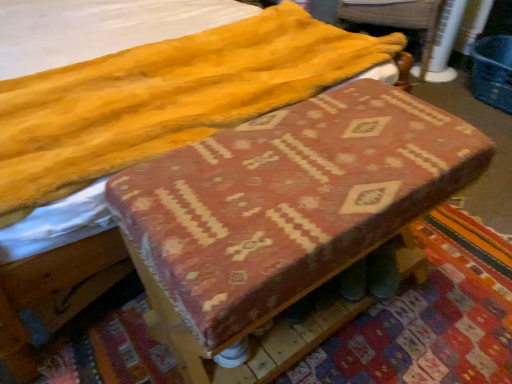
Question: From a real-world perspective, is textured fabric changing table at center positioned above or below wooden swivel chair at upper right?

Choices:
 (A) below
 (B) above

Answer: (B)

Question: Is textured fabric changing table at center bigger or smaller than wooden swivel chair at upper right?

Choices:
 (A) big
 (B) small

Answer: (A)

Question: Is textured fabric changing table at center inside the boundaries of wooden swivel chair at upper right, or outside?

Choices:
 (A) outside
 (B) inside

Answer: (A)

Question: Considering the positions of wooden swivel chair at upper right and textured fabric changing table at center in the image, is wooden swivel chair at upper right wider or thinner than textured fabric changing table at center?

Choices:
 (A) thin
 (B) wide

Answer: (B)

Question: From their relative heights in the image, would you say wooden swivel chair at upper right is taller or shorter than textured fabric changing table at center?

Choices:
 (A) tall
 (B) short

Answer: (B)

Question: From a real-world perspective, is wooden swivel chair at upper right positioned above or below textured fabric changing table at center?

Choices:
 (A) above
 (B) below

Answer: (B)

Question: Would you say wooden swivel chair at upper right is to the left or to the right of textured fabric changing table at center in the picture?

Choices:
 (A) left
 (B) right

Answer: (B)